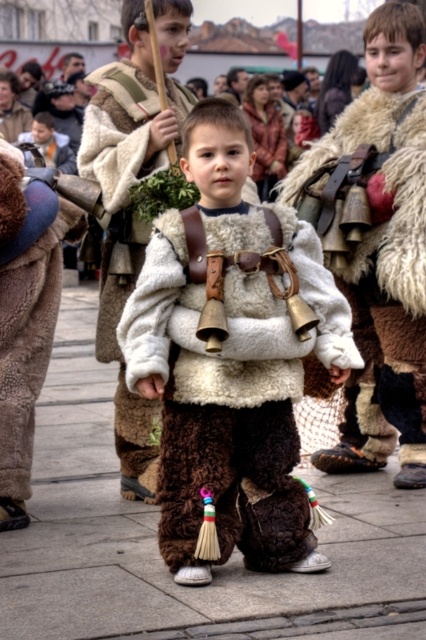
Question: Can you confirm if fuzzy white vest at center is smaller than fuzzy white fur coat at center?

Choices:
 (A) yes
 (B) no

Answer: (B)

Question: Which of the following is the closest to the observer?

Choices:
 (A) fuzzy white vest at center
 (B) fuzzy white fur coat at center
 (C) brown fur pants at center

Answer: (C)

Question: Considering the relative positions of fuzzy brown pants at center and brown fur pants at center in the image provided, where is fuzzy brown pants at center located with respect to brown fur pants at center?

Choices:
 (A) right
 (B) left

Answer: (A)

Question: Does fuzzy white vest at center have a greater width compared to fuzzy white fur coat at center?

Choices:
 (A) yes
 (B) no

Answer: (A)

Question: Which object appears farthest from the camera in this image?

Choices:
 (A) fuzzy brown pants at center
 (B) brown fur pants at center

Answer: (A)

Question: Estimate the real-world distances between objects in this image. Which object is closer to the fuzzy white vest at center?

Choices:
 (A) brown fur pants at center
 (B) fuzzy brown pants at center
 (C) fuzzy white fur coat at center

Answer: (B)